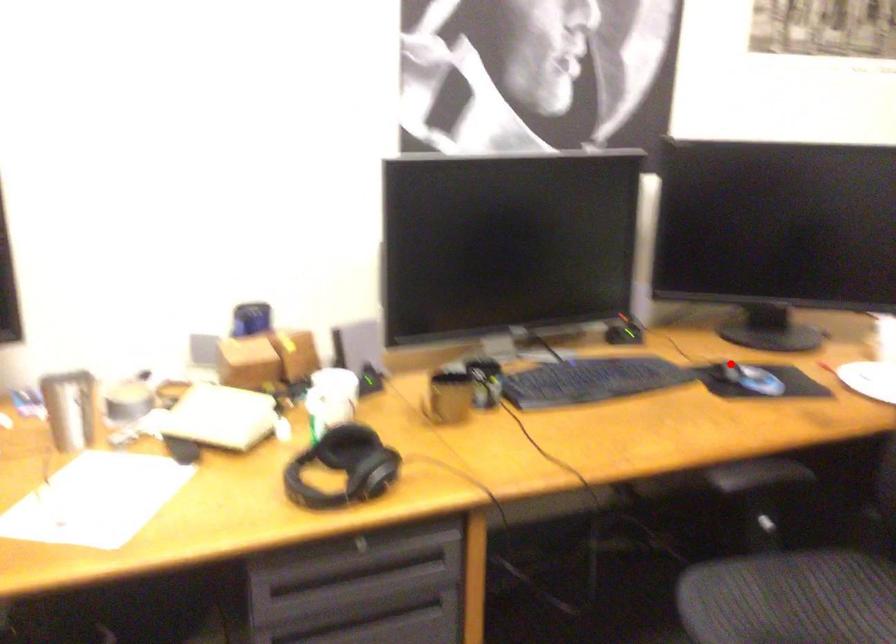
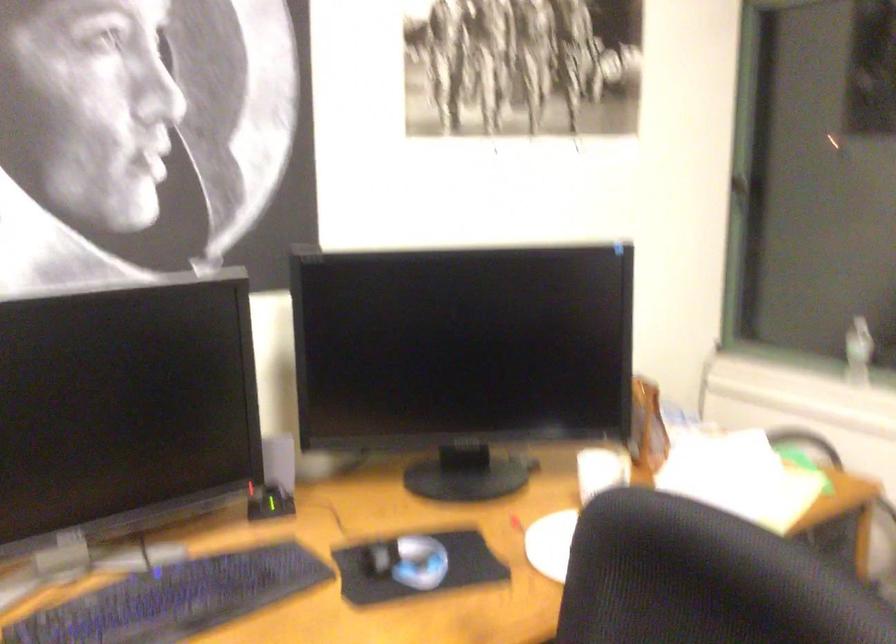
The point at the highlighted location is marked in the first image. Where is the corresponding point in the second image?

(380, 558)